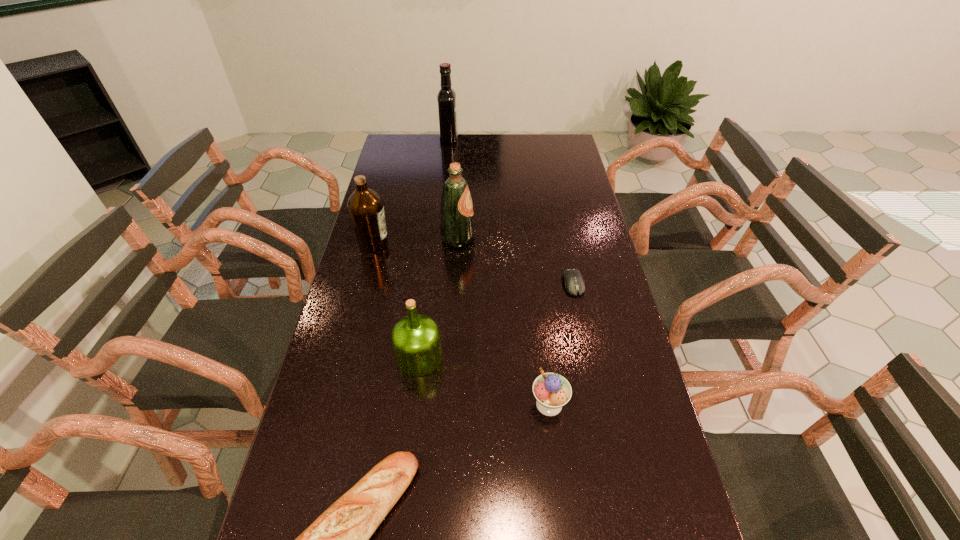
What are the coordinates of `vacant region that satisfies the following two spatial constraints: 1. on the back side of the second nearest object; 2. on the front-facing side of the farthest object` in the screenshot? It's located at (516, 139).

The image size is (960, 540). I want to click on free space that satisfies the following two spatial constraints: 1. on the front-facing side of the farthest object; 2. on the back side of the second nearest object, so click(421, 404).

This screenshot has height=540, width=960. I want to click on vacant position in the image that satisfies the following two spatial constraints: 1. on the label of the leftmost olive oil; 2. on the left side of the nearest olive oil, so click(x=345, y=357).

The width and height of the screenshot is (960, 540). In order to click on vacant area in the image that satisfies the following two spatial constraints: 1. on the label of the leftmost olive oil; 2. on the right side of the third nearest object in this screenshot , I will do `click(345, 357)`.